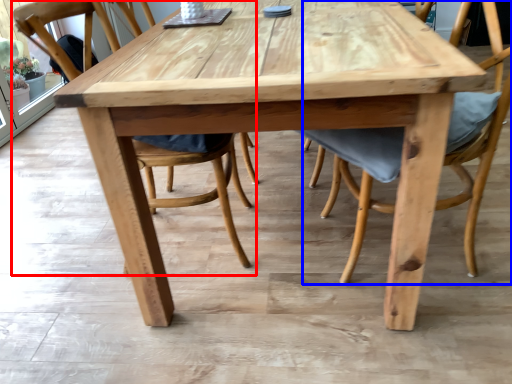
Question: Which of the following is the farthest to the observer, chair (highlighted by a red box) or chair (highlighted by a blue box)?

Choices:
 (A) chair
 (B) chair

Answer: (A)